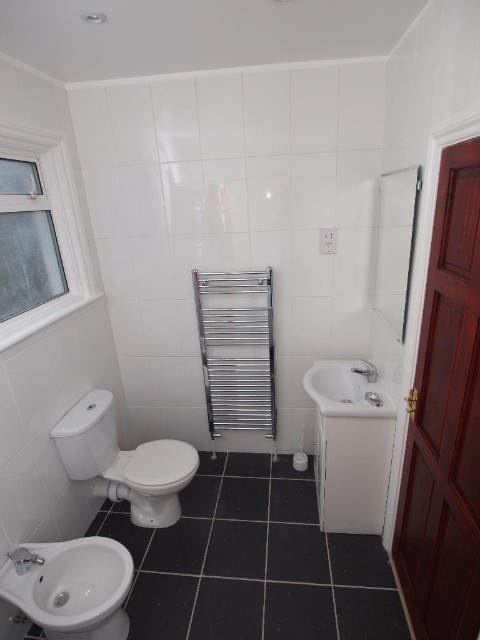
Question: Among these points, which one is farthest from the camera?

Choices:
 (A) (159, 515)
 (B) (312, 388)
 (C) (80, 579)

Answer: (A)

Question: Does white plastic window at left lie in front of white glossy sink at lower right?

Choices:
 (A) no
 (B) yes

Answer: (B)

Question: Is white glossy bidet at lower left positioned before white plastic window at left?

Choices:
 (A) yes
 (B) no

Answer: (A)

Question: Which of the following is the closest to the observer?

Choices:
 (A) [352, 401]
 (B) [76, 618]
 (C) [40, 316]

Answer: (B)

Question: Which is nearer to the white glossy toilet bowl at lower left?

Choices:
 (A) white plastic window at left
 (B) white glossy sink at lower right
 (C) white glossy bidet at lower left

Answer: (C)

Question: Is white glossy bidet at lower left bigger than white glossy sink at lower right?

Choices:
 (A) yes
 (B) no

Answer: (A)